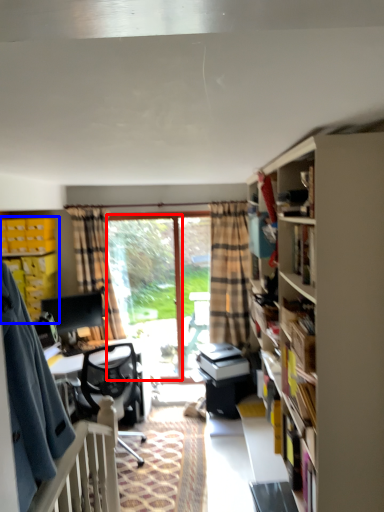
Question: Among these objects, which one is nearest to the camera, window screen (highlighted by a red box) or cabinet (highlighted by a blue box)?

Choices:
 (A) window screen
 (B) cabinet

Answer: (B)